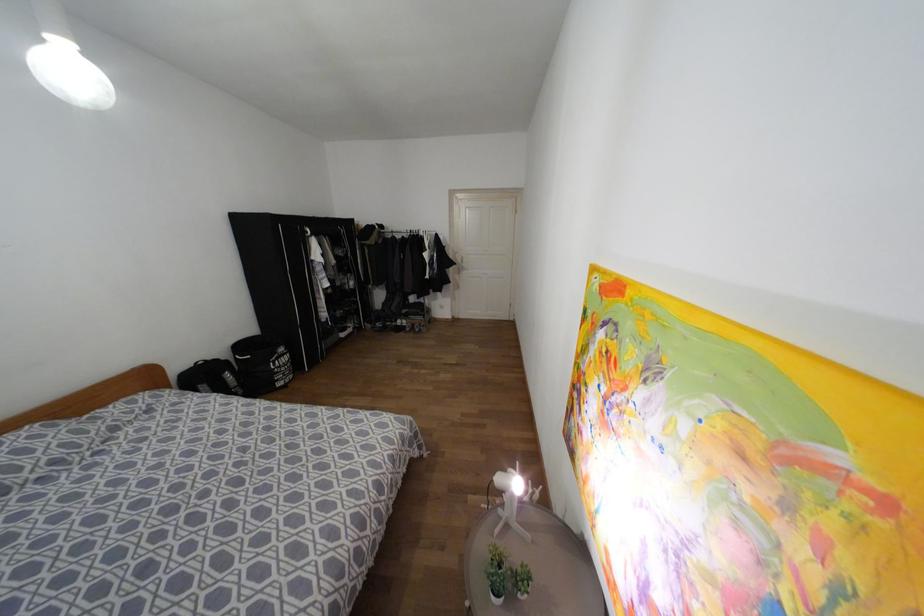
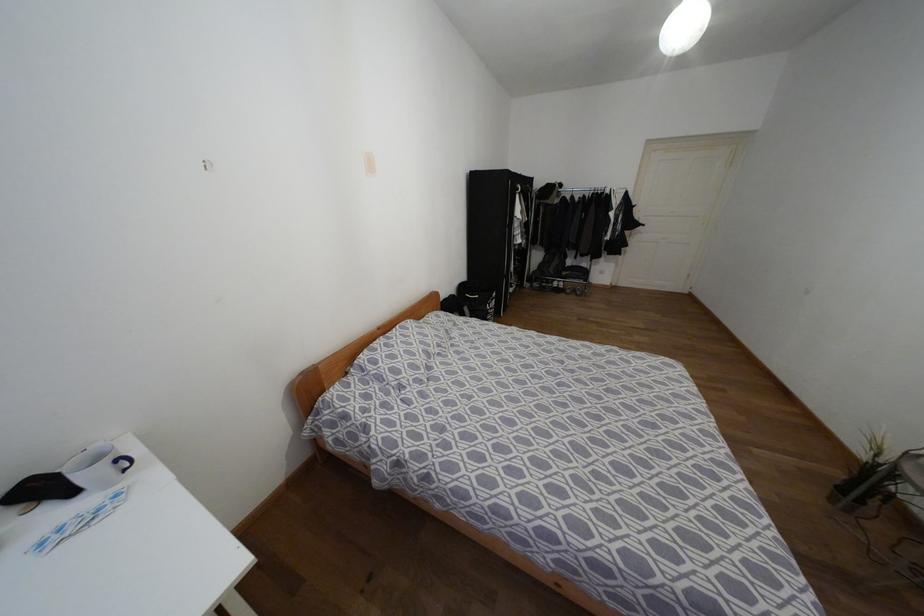
Question: What movement of the cameraman would produce the second image?

Choices:
 (A) Left
 (B) Right
 (C) Forward
 (D) Backward

Answer: (A)